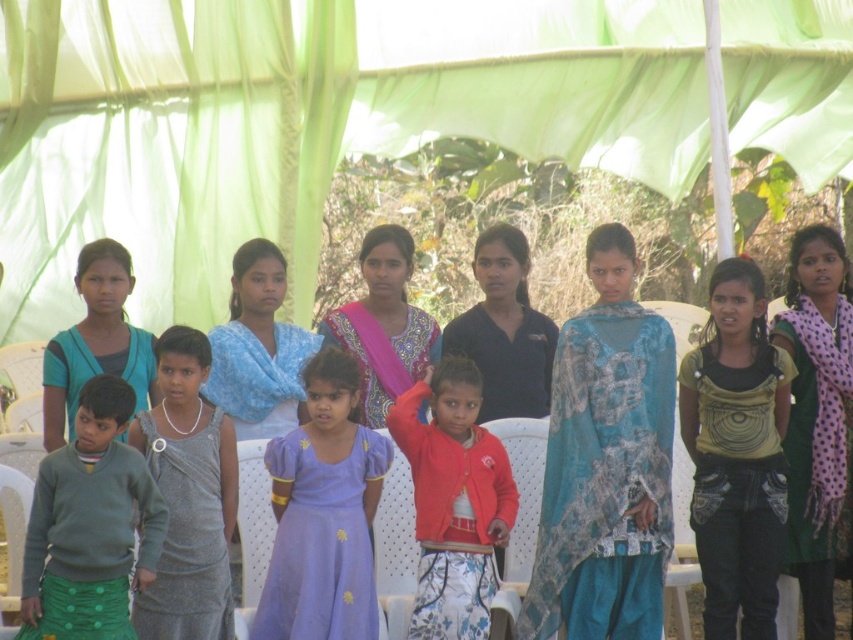
You are a photographer trying to capture a detail shot of the clothing items in the scene. You need to know which clothing item is positioned lower between the red matte cardigan at center and the blue fabric scarf at center. Which one should you focus on first?

The red matte cardigan at center is located below the blue fabric scarf at center, so you should focus on the red matte cardigan at center first as it is lower in position.

Consider the image. You are taking a photo of the gathering under the light green canopy. You want to focus on the point at the bottom right corner of the image. Which point, point at (321, 616) or point at (276, 344), is closer to the camera and should be in focus?

Point at (321, 616) is closer to the camera than point at (276, 344), so it should be in focus.

You are organizing a photo shoot and need to decide which clothing item to feature first based on their size. Which one is taller between the red matte cardigan at center and the blue fabric scarf at center?

The red matte cardigan at center is taller than the blue fabric scarf at center according to the description.